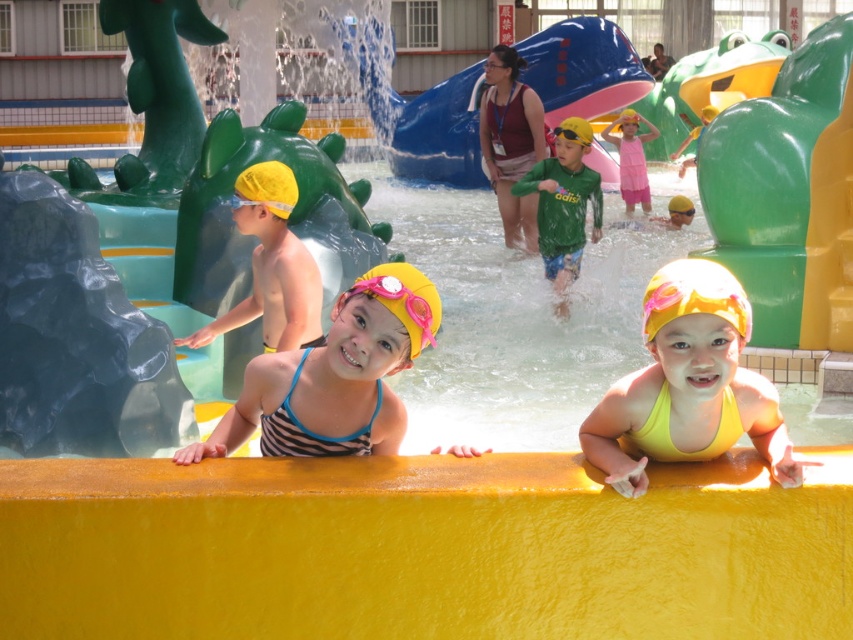
Question: Which point is closer to the camera taking this photo?

Choices:
 (A) (311, 365)
 (B) (744, 372)

Answer: (B)

Question: Is yellow matte swimsuit at center wider than blue rubber slide at center?

Choices:
 (A) no
 (B) yes

Answer: (A)

Question: Among these points, which one is farthest from the camera?

Choices:
 (A) (328, 403)
 (B) (680, 314)
 (C) (267, 284)
 (D) (648, 192)

Answer: (D)

Question: Which object is closer to the camera taking this photo?

Choices:
 (A) blue rubber slide at center
 (B) striped fabric swimsuit at center

Answer: (B)

Question: Is yellow matte swim cap at center above green matte shirt at center?

Choices:
 (A) no
 (B) yes

Answer: (A)

Question: Is blue rubber slide at center to the right of yellow matte swim cap at center from the viewer's perspective?

Choices:
 (A) yes
 (B) no

Answer: (A)